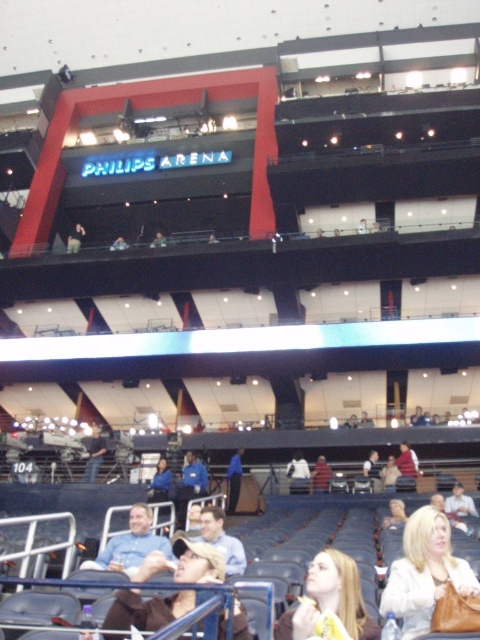
Does white leather jacket at lower right have a lesser width compared to light brown leather jacket at lower center?

Yes.

Does point (430, 506) come behind point (204, 563)?

That is True.

I want to click on white leather jacket at lower right, so click(424, 572).

Does light brown leather jacket at lower center appear over blonde hair at center?

No.

Describe the element at coordinates (146, 609) in the screenshot. The height and width of the screenshot is (640, 480). I see `light brown leather jacket at lower center` at that location.

Locate an element on the screen. light brown leather jacket at lower center is located at coordinates point(146,609).

I want to click on light brown leather jacket at lower center, so click(146, 609).

Is white leather jacket at lower right taller than blonde hair at center?

Correct, white leather jacket at lower right is much taller as blonde hair at center.

From the picture: Is white leather jacket at lower right smaller than blonde hair at center?

No, white leather jacket at lower right is not smaller than blonde hair at center.

Measure the distance between white leather jacket at lower right and camera.

The distance of white leather jacket at lower right from camera is 16.34 feet.

Where is `white leather jacket at lower right`? Image resolution: width=480 pixels, height=640 pixels. white leather jacket at lower right is located at coordinates (424, 572).